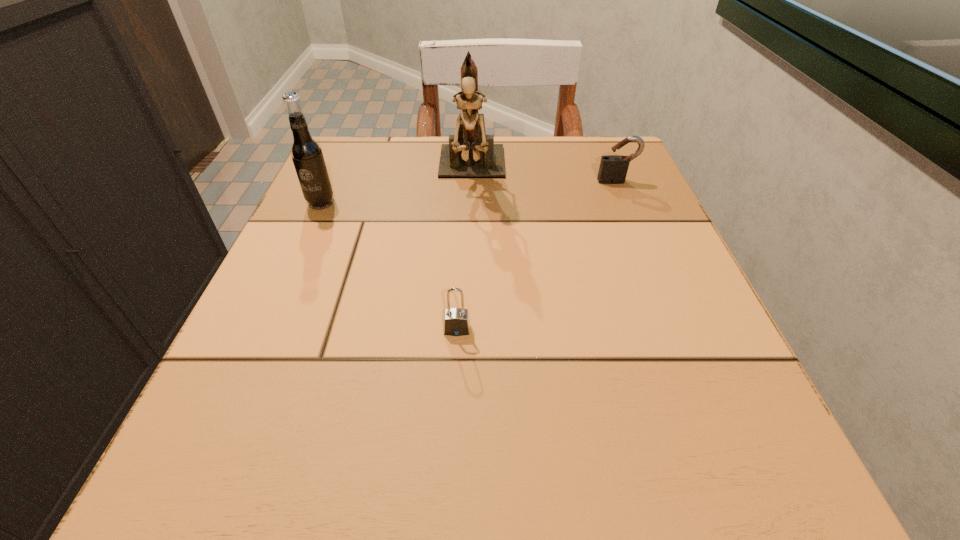
This screenshot has height=540, width=960. I want to click on free region located on the shackle of the nearest object, so click(x=452, y=424).

Image resolution: width=960 pixels, height=540 pixels. What are the coordinates of `figurine located at the far edge` in the screenshot? It's located at (471, 153).

Where is `root beer located in the far edge section of the desktop`? Image resolution: width=960 pixels, height=540 pixels. root beer located in the far edge section of the desktop is located at coordinates (306, 153).

This screenshot has width=960, height=540. What are the coordinates of `padlock present at the far edge` in the screenshot? It's located at (615, 167).

This screenshot has height=540, width=960. Find the location of `object present at the left edge`. object present at the left edge is located at coordinates (306, 153).

Locate an element on the screen. Image resolution: width=960 pixels, height=540 pixels. object that is at the right edge is located at coordinates (615, 167).

Find the location of a particular element. This screenshot has width=960, height=540. object that is positioned at the far left corner is located at coordinates [306, 153].

In order to click on object that is positioned at the far right corner in this screenshot , I will do `click(615, 167)`.

At what (x,y) coordinates should I click in order to perform the action: click on vacant area at the far edge of the desktop. Please return your answer as a coordinate pair (x, y). The image size is (960, 540). Looking at the image, I should click on (544, 178).

Find the location of `free space at the near edge of the desktop`. free space at the near edge of the desktop is located at coordinates (456, 454).